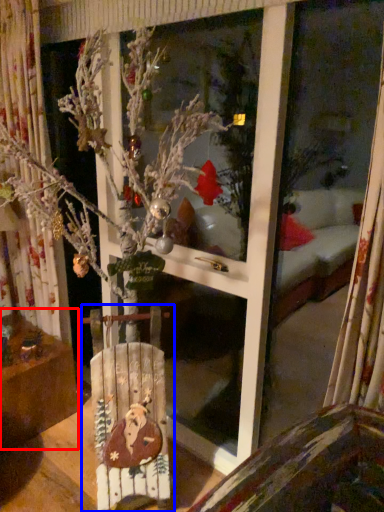
Question: Which of the following is the closest to the observer, furniture (highlighted by a red box) or armchair (highlighted by a blue box)?

Choices:
 (A) furniture
 (B) armchair

Answer: (B)